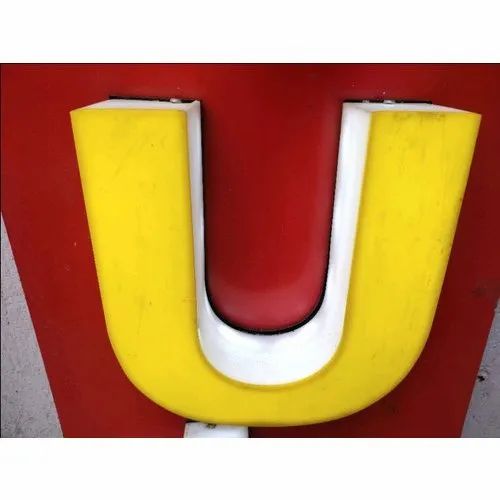
Where is `concrete wall`? Image resolution: width=500 pixels, height=500 pixels. concrete wall is located at coordinates click(4, 401).